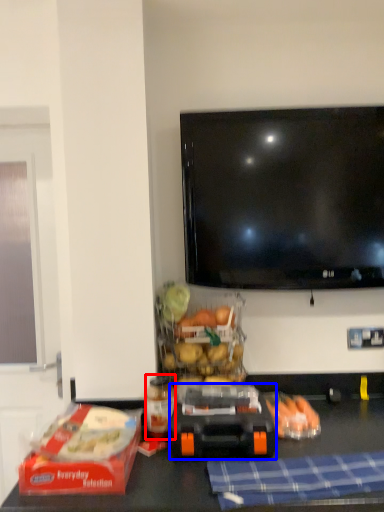
Question: Among these objects, which one is nearest to the camera, bottle (highlighted by a red box) or appliance (highlighted by a blue box)?

Choices:
 (A) bottle
 (B) appliance

Answer: (B)